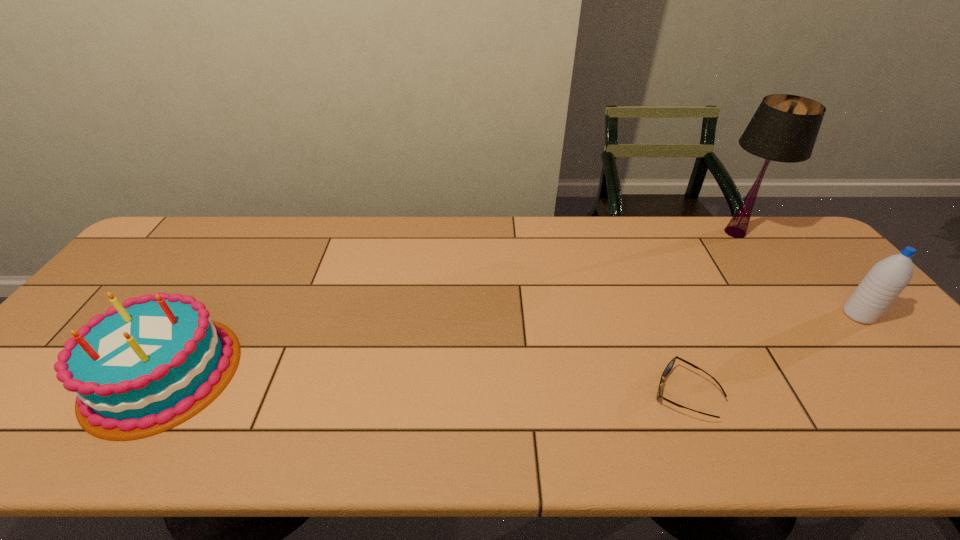
In the image, there is a desktop. Where is `vacant region at the far edge`? vacant region at the far edge is located at coordinates (714, 224).

This screenshot has width=960, height=540. Find the location of `free space at the near edge of the desktop`. free space at the near edge of the desktop is located at coordinates (153, 443).

I want to click on vacant point at the left edge, so click(x=160, y=283).

The width and height of the screenshot is (960, 540). I want to click on free space at the right edge, so pyautogui.click(x=871, y=351).

At what (x,y) coordinates should I click in order to perform the action: click on free space at the far left corner of the desktop. Please return your answer as a coordinate pair (x, y). Looking at the image, I should click on (172, 244).

Image resolution: width=960 pixels, height=540 pixels. Find the location of `free point between the birthday cake and the rightmost object`. free point between the birthday cake and the rightmost object is located at coordinates (511, 344).

Where is `blank region between the sunglasses and the birthday cake`? blank region between the sunglasses and the birthday cake is located at coordinates (423, 383).

Find the location of a particular element. Image resolution: width=960 pixels, height=540 pixels. vacant region between the water bottle and the third object from right to left is located at coordinates (771, 354).

Identify the location of vacant space that is in between the rightmost object and the leftmost object. (511, 344).

Identify the location of free spot between the birthday cake and the rightmost object. (511, 344).